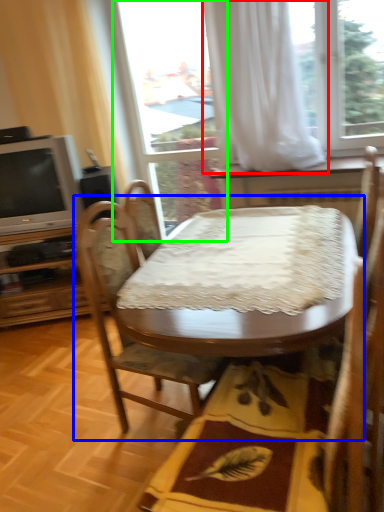
Question: Which object is the closest to the curtain (highlighted by a red box)? Choose among these: kitchen & dining room table (highlighted by a blue box) or glass door (highlighted by a green box).

Choices:
 (A) kitchen & dining room table
 (B) glass door

Answer: (B)